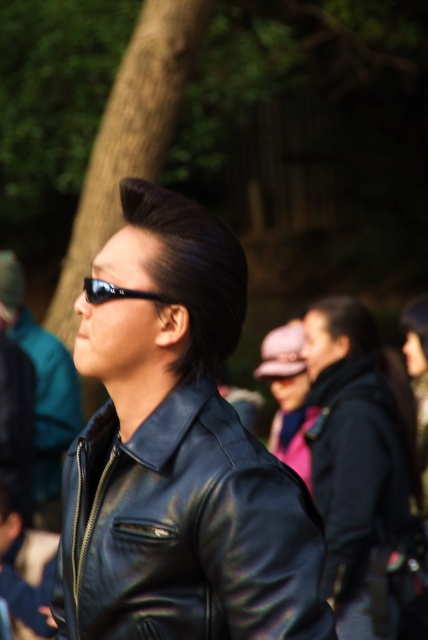
You are a photographer who wants to adjust the focus of your camera to capture both the shiny black leather jacket at center and the shiny black jacket at center clearly. Which of the two jackets should you focus on to ensure both are in focus?

You should focus on the shiny black leather jacket at center because it is located below the shiny black jacket at center, so focusing on the closer object will ensure both are in focus.

You are a photographer who wants to ensure that both the shiny black leather jacket at center and the sunglasses at center are clearly visible in your photo. Given their sizes, which object might require more careful framing to avoid being too small in the composition?

The sunglasses at center are smaller in size compared to the shiny black leather jacket at center, so they might require more careful framing to ensure they are clearly visible in the composition.